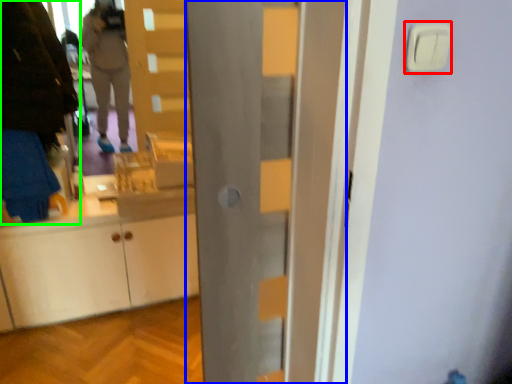
Question: Which object is the farthest from light switch (highlighted by a red box)? Choose among these: door (highlighted by a blue box) or person (highlighted by a green box).

Choices:
 (A) door
 (B) person

Answer: (B)